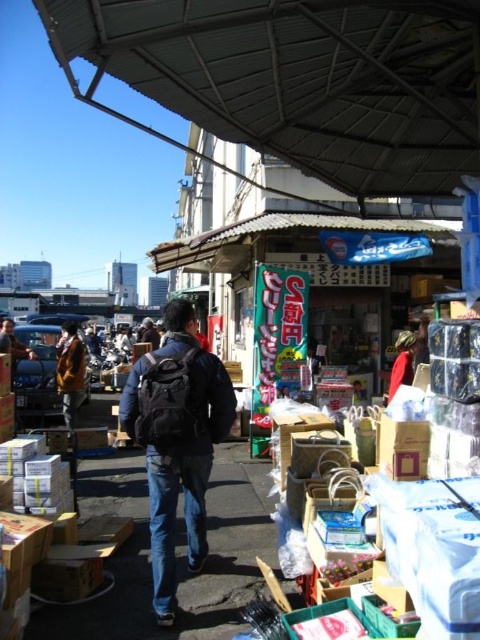
Question: Can you confirm if yellow fabric jacket at center is positioned to the left of red fabric bag at center?

Choices:
 (A) no
 (B) yes

Answer: (B)

Question: Is yellow fabric jacket at center positioned behind red fabric bag at center?

Choices:
 (A) no
 (B) yes

Answer: (B)

Question: Can you confirm if metallic gray canopy at upper center is bigger than black backpack at center?

Choices:
 (A) no
 (B) yes

Answer: (B)

Question: Which object appears farthest from the camera in this image?

Choices:
 (A) metallic gray canopy at upper center
 (B) red fabric bag at center

Answer: (B)

Question: Which point appears farthest from the camera in this image?

Choices:
 (A) (387, 65)
 (B) (79, 376)
 (C) (226, 432)

Answer: (B)

Question: Which object is the closest to the yellow fabric jacket at center?

Choices:
 (A) black backpack at center
 (B) metallic gray canopy at upper center
 (C) red fabric bag at center

Answer: (C)